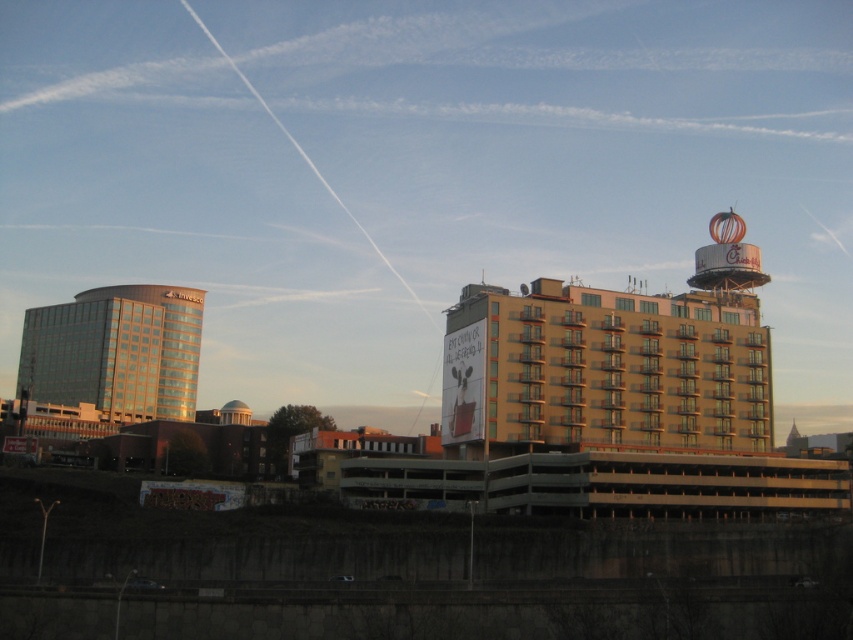
You are standing at the center of the image and want to locate the yellow concrete building at center. According to the coordinates provided, in which direction should you look to find it?

The yellow concrete building at center is located at coordinates point (606,369), so you should look towards the center of the image to find it.

You are standing at the base of the parking structure and see two points marked in the image. Which point, point (537,346) or point (155,346), is closer to you?

Point (537,346) is closer to the viewer than point (155,346).

You are a city planner analyzing the urban layout. Given the yellow concrete building at center and the shiny glass building at left, which one has a narrower width when viewed from this perspective?

The yellow concrete building at center is thinner than the shiny glass building at left, so it has a narrower width from this viewpoint.